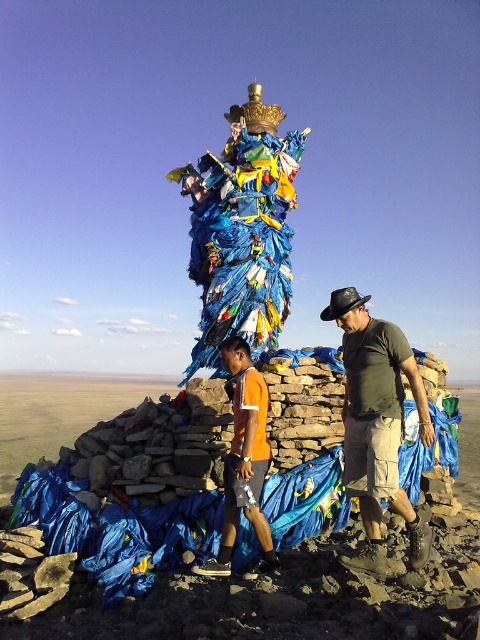
Question: Does matte black shirt at center have a lesser width compared to orange fabric shorts at center?

Choices:
 (A) no
 (B) yes

Answer: (A)

Question: Is matte black shirt at center thinner than orange fabric shorts at center?

Choices:
 (A) yes
 (B) no

Answer: (B)

Question: Among these points, which one is farthest from the camera?

Choices:
 (A) (420, 541)
 (B) (245, 416)

Answer: (B)

Question: Is matte black shirt at center to the right of orange fabric shorts at center from the viewer's perspective?

Choices:
 (A) yes
 (B) no

Answer: (A)